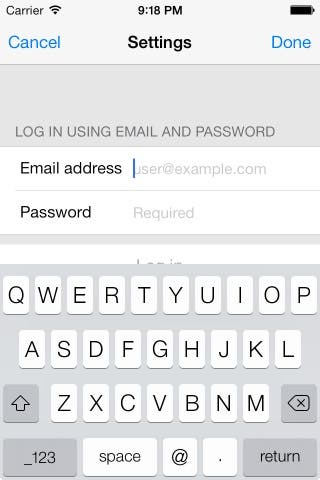
I want to click on qwerty keypad, so click(x=182, y=302).